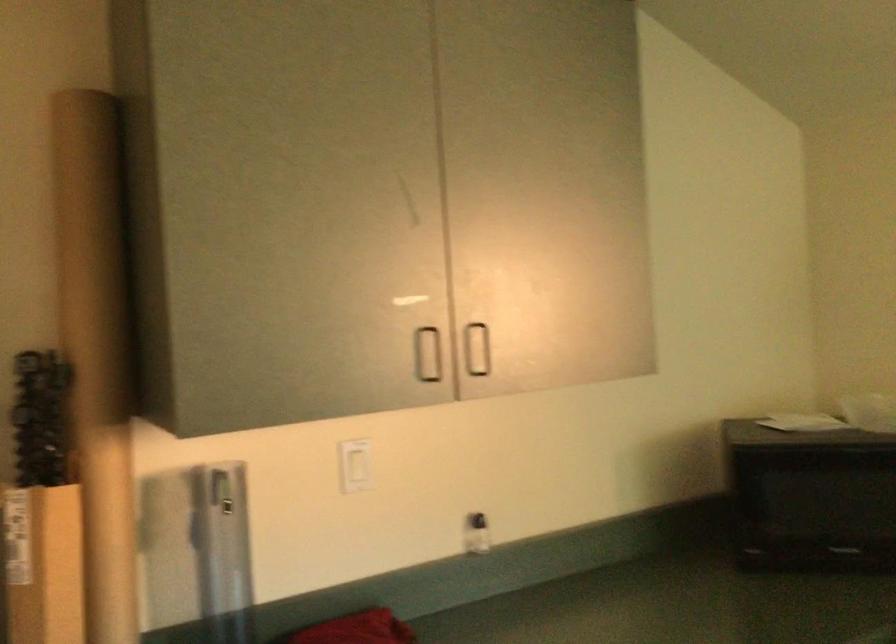
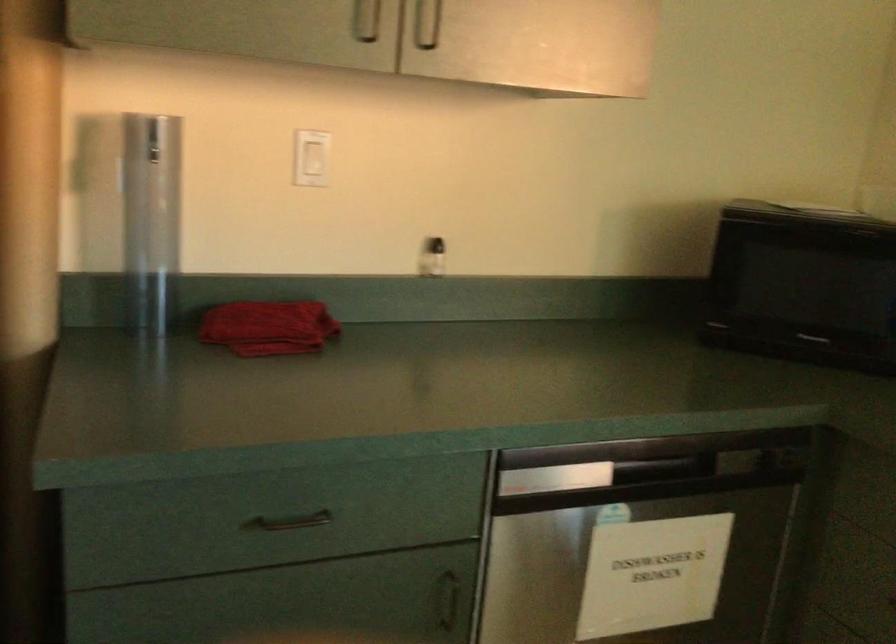
Question: Based on the continuous images, in which direction is the camera rotating? Reply with the corresponding letter.

Choices:
 (A) Left
 (B) Right
 (C) Up
 (D) Down

Answer: (D)